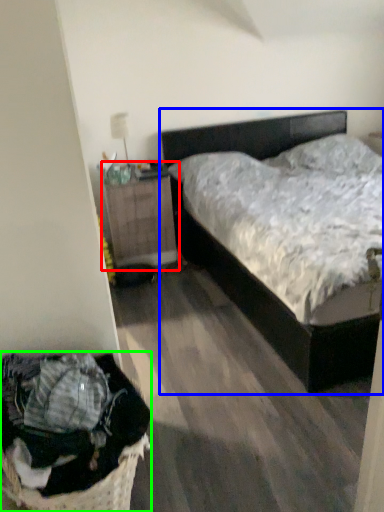
Question: Which object is positioned farthest from nightstand (highlighted by a red box)? Select from bed (highlighted by a blue box) and laundry basket (highlighted by a green box).

Choices:
 (A) bed
 (B) laundry basket

Answer: (B)